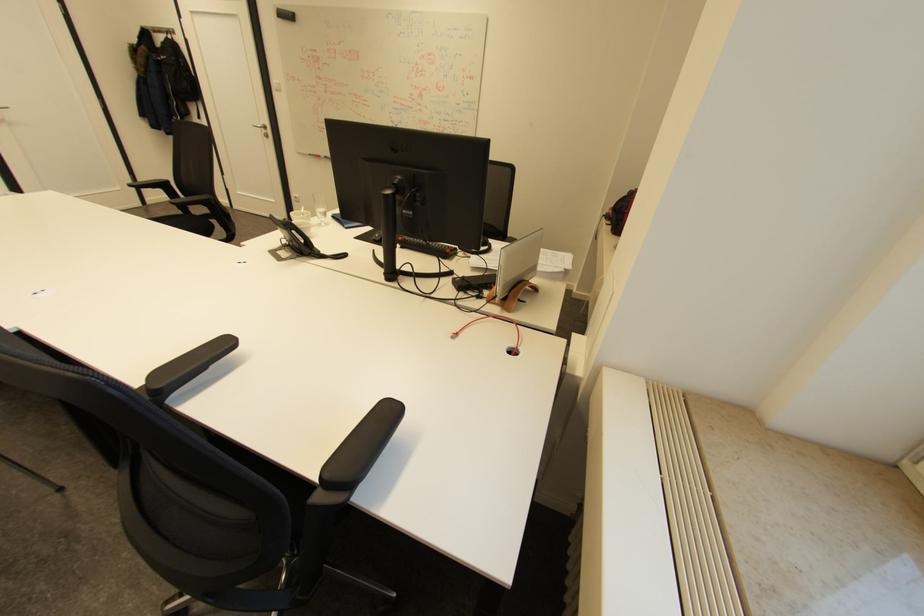
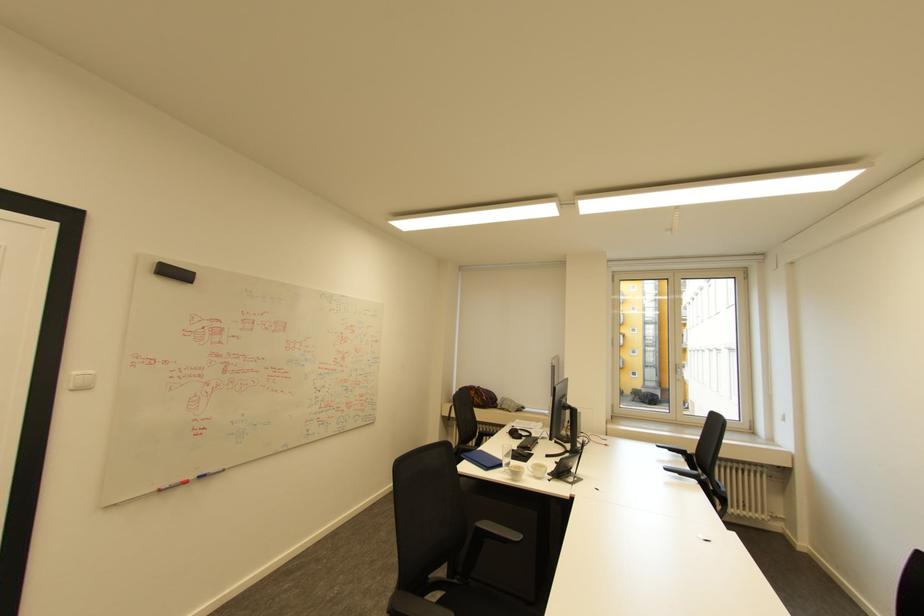
The point at (281, 81) is marked in the first image. Where is the corresponding point in the second image?

(79, 371)